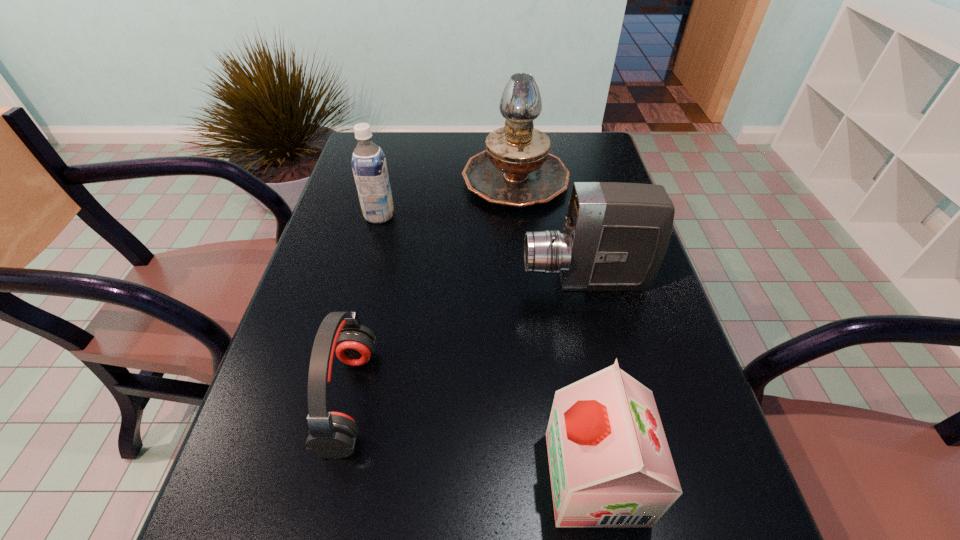
The width and height of the screenshot is (960, 540). I want to click on vacant space located 0.280m with the cap open on the nearer soya milk, so click(376, 477).

At what (x,y) coordinates should I click in order to perform the action: click on vacant space located 0.210m with the cap open on the nearer soya milk. Please return your answer as a coordinate pair (x, y). The height and width of the screenshot is (540, 960). Looking at the image, I should click on (420, 477).

Identify the location of vacant position located with the cap open on the nearer soya milk. This screenshot has height=540, width=960. (346, 477).

This screenshot has height=540, width=960. Identify the location of vacant region located on the ear cups of the shortest object. (578, 399).

Find the location of a particular element. This screenshot has height=540, width=960. object positioned at the far edge is located at coordinates click(516, 170).

Find the location of `soya milk that is positioned at the left edge`. soya milk that is positioned at the left edge is located at coordinates (368, 161).

At what (x,y) coordinates should I click in order to perform the action: click on earphone that is at the left edge. Please return your answer as a coordinate pair (x, y). This screenshot has width=960, height=540. Looking at the image, I should click on (332, 435).

I want to click on oil lamp present at the right edge, so click(x=516, y=170).

Locate an element on the screen. The height and width of the screenshot is (540, 960). camcorder at the right edge is located at coordinates (615, 236).

The height and width of the screenshot is (540, 960). Identify the location of soya milk that is at the right edge. (610, 465).